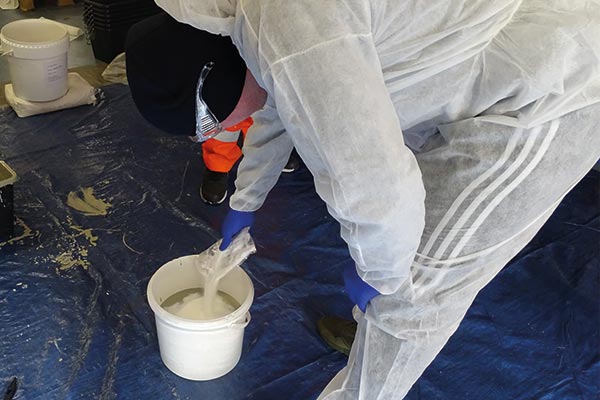
Where is `white plastic bucket`? white plastic bucket is located at coordinates (22, 71), (183, 335).